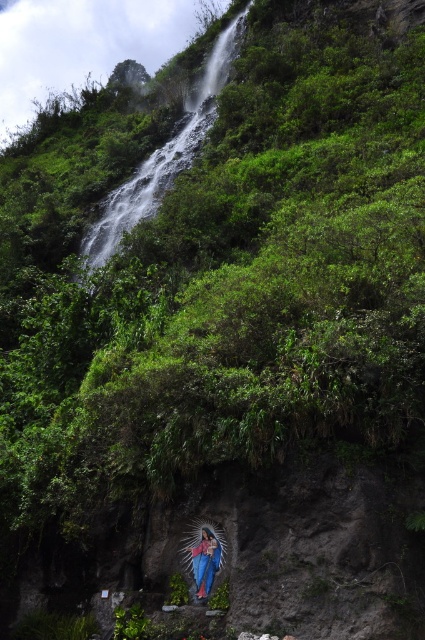
Does green leafy waterfall at upper left come in front of smooth blue statue at lower center?

That is False.

Does point (116, 237) come closer to viewer compared to point (203, 564)?

That is False.

Image resolution: width=425 pixels, height=640 pixels. Identify the location of green leafy waterfall at upper left. (161, 157).